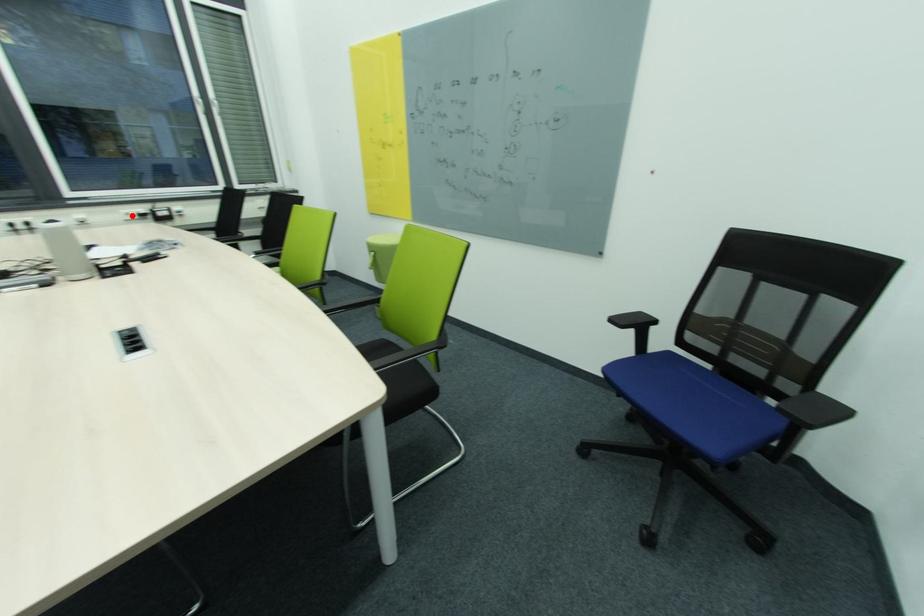
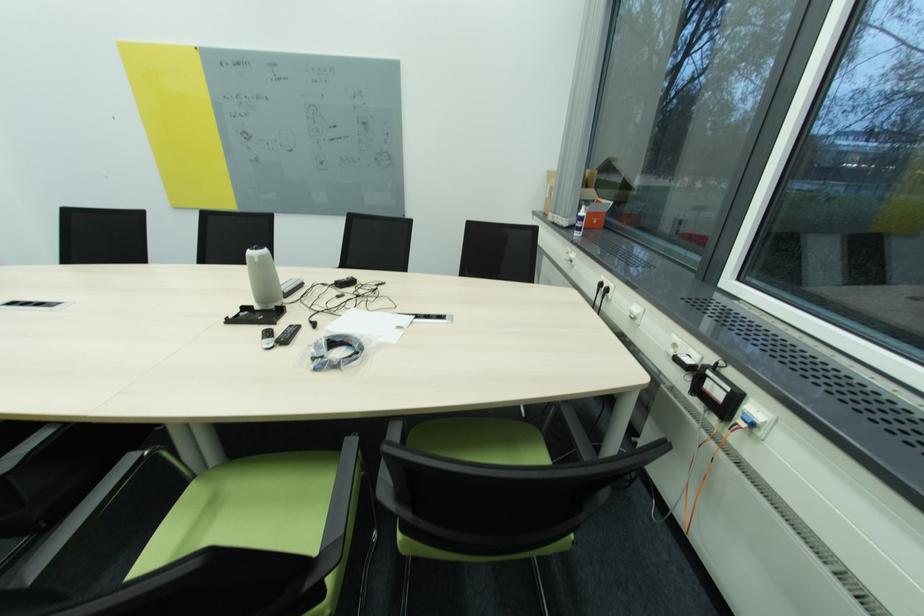
The point at the highlighted location is marked in the first image. Where is the corresponding point in the second image?

(679, 346)